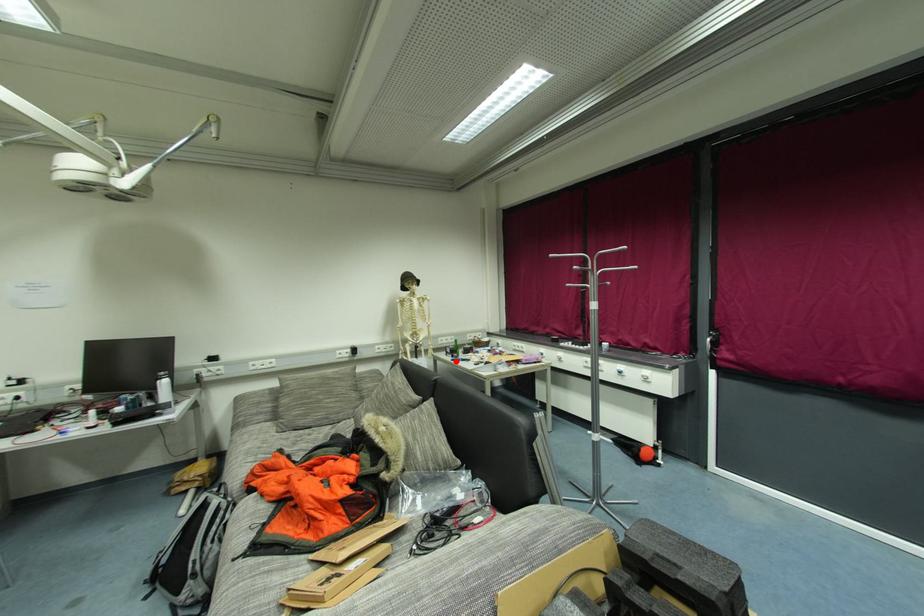
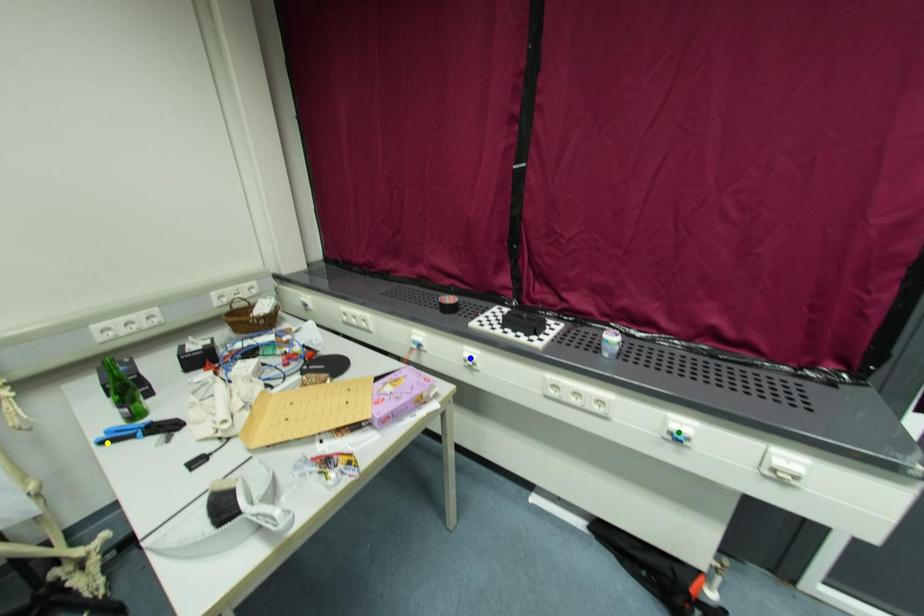
Question: I am providing you with two images of the same scene from different viewpoints. A red point is marked on the first image. You are given multiple points on the second image. Which point in image 2 represents the same 3d spot as the red point in image 1?

Choices:
 (A) green point
 (B) yellow point
 (C) blue point

Answer: (B)